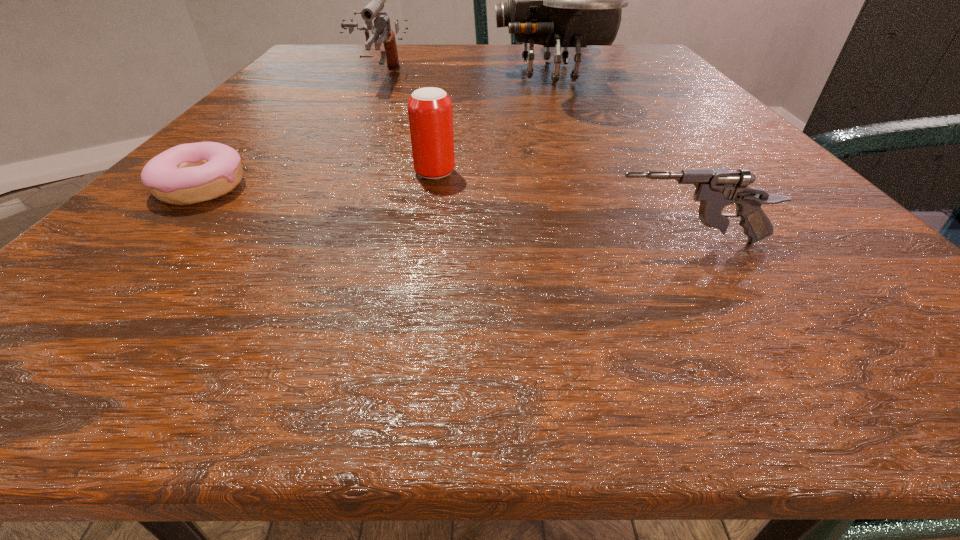
Find the location of a particular element. The width and height of the screenshot is (960, 540). vacant space at the near left corner is located at coordinates (77, 282).

You are a GUI agent. You are given a task and a screenshot of the screen. Output one action in this format:
    pyautogui.click(x=<x>, y=<y>)
    Task: Click on the free region at the far right corner
    This screenshot has height=540, width=960.
    Given the screenshot: What is the action you would take?
    pyautogui.click(x=647, y=72)

Find the location of a particular element. The image size is (960, 540). free space between the third object from right to left and the fourth shortest object is located at coordinates (407, 126).

What are the coordinates of `free spot between the shortest object and the right gun` in the screenshot? It's located at (445, 215).

Where is `unoccupied position between the farther gun and the drone`? This screenshot has width=960, height=540. unoccupied position between the farther gun and the drone is located at coordinates (465, 76).

Identify the location of free spot between the beer can and the taller gun. The width and height of the screenshot is (960, 540). click(407, 126).

I want to click on free space between the left gun and the tallest object, so click(x=465, y=76).

Image resolution: width=960 pixels, height=540 pixels. What are the coordinates of `vacant space that's between the shorter gun and the second tallest object` in the screenshot? It's located at (534, 160).

Locate an element on the screen. The width and height of the screenshot is (960, 540). empty location between the drone and the left gun is located at coordinates (465, 76).

Where is `empty space between the taller gun and the drone`? empty space between the taller gun and the drone is located at coordinates click(x=465, y=76).